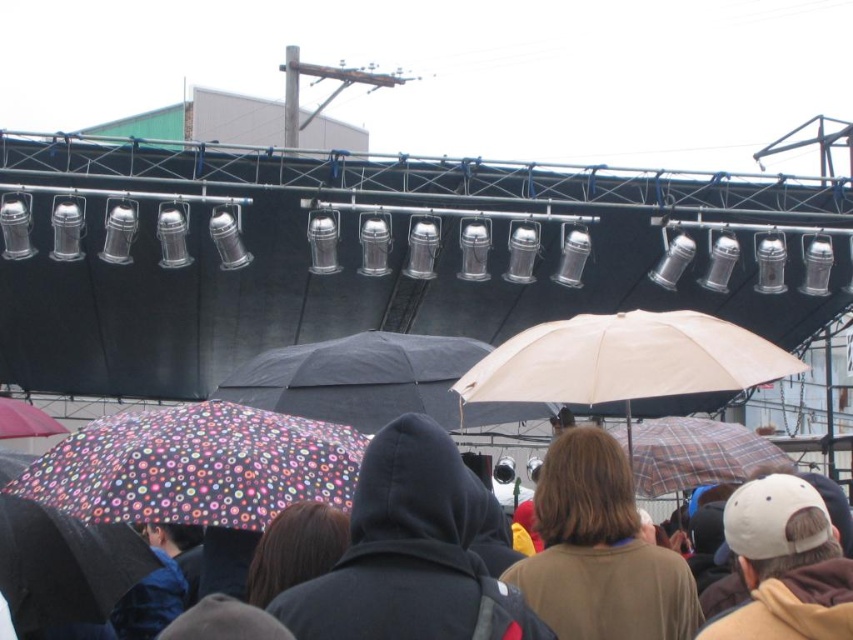
You are a photographer standing at the camera position. You want to capture a closeup shot of the beige matte umbrella at center. Given that your camera can focus on objects within 40 meters, will you be able to take the photo without moving closer?

The beige matte umbrella at center is 39.34 meters away from the camera. Since your camera can focus within 40 meters, you can take the photo without moving closer.

You are standing in the crowd under the umbrellas at the event. You see two points marked in the image. Which point is closer to you, point (267, 397) or point (55, 433)?

Point (267, 397) is closer to the viewer than point (55, 433).